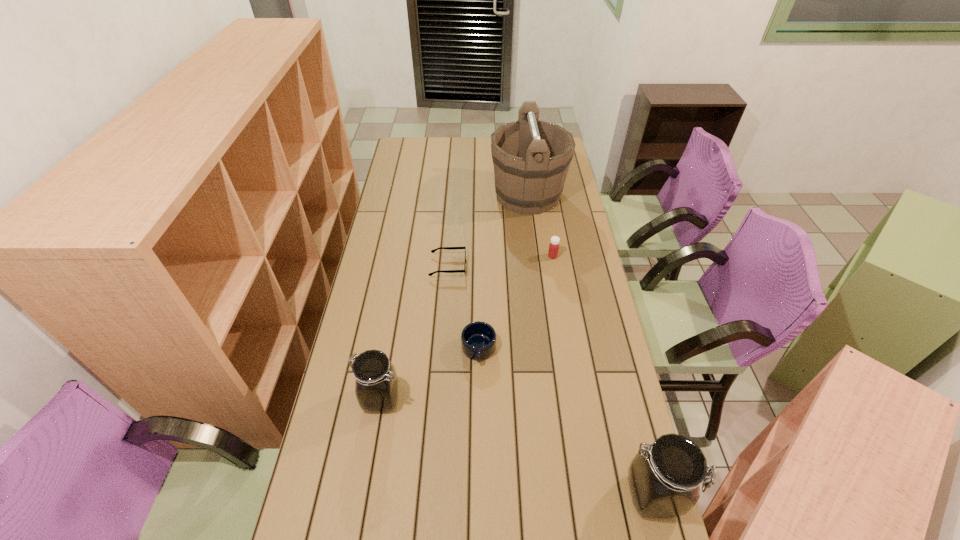
Locate an element on the screen. blank region between the spectacles and the second shortest object is located at coordinates (464, 308).

Identify the location of free spot between the nearest object and the mug. This screenshot has height=540, width=960. (565, 422).

The width and height of the screenshot is (960, 540). Find the location of `vacant area that lies between the bucket and the shortest object`. vacant area that lies between the bucket and the shortest object is located at coordinates (488, 231).

At what (x,y) coordinates should I click in order to perform the action: click on vacant area that lies between the nearer jar and the fourth tallest object. Please return your answer as a coordinate pair (x, y). Looking at the image, I should click on (603, 375).

Where is `the fourth closest object to the medicine`? The height and width of the screenshot is (540, 960). the fourth closest object to the medicine is located at coordinates (376, 386).

Find the location of `the fifth closest object to the shortest object`. the fifth closest object to the shortest object is located at coordinates (664, 479).

The image size is (960, 540). I want to click on blank space that satisfies the following two spatial constraints: 1. with the handle on the side of the second shortest object; 2. on the lid of the leftmost object, so click(478, 399).